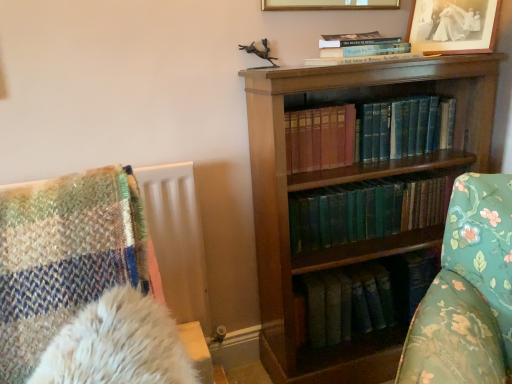
Question: Can you confirm if green leather book at center, the 1th book in the bottom-to-top sequence, is thinner than blue leather book at center, which is the 2th book from top to bottom?

Choices:
 (A) yes
 (B) no

Answer: (B)

Question: From the image's perspective, would you say green leather book at center, positioned as the third book in top-to-bottom order, is shown under blue leather book at center, the 2th book ordered from the bottom?

Choices:
 (A) yes
 (B) no

Answer: (A)

Question: Does green leather book at center, the 1th book in the bottom-to-top sequence, have a greater width compared to blue leather book at center, which is the 2th book from top to bottom?

Choices:
 (A) yes
 (B) no

Answer: (A)

Question: Considering the relative sizes of green leather book at center, positioned as the third book in top-to-bottom order, and blue leather book at center, the 2th book ordered from the bottom, in the image provided, is green leather book at center, positioned as the third book in top-to-bottom order, bigger than blue leather book at center, the 2th book ordered from the bottom,?

Choices:
 (A) yes
 (B) no

Answer: (B)

Question: Does green leather book at center, positioned as the third book in top-to-bottom order, contain blue leather book at center, which is the 2th book from top to bottom?

Choices:
 (A) no
 (B) yes

Answer: (A)

Question: Is green leather book at center, positioned as the third book in top-to-bottom order, facing towards blue leather book at center, which is the 2th book from top to bottom?

Choices:
 (A) no
 (B) yes

Answer: (A)

Question: Considering the relative sizes of black paper picture frame at upper right, which ranks as the first picture frame in right-to-left order, and blue leather book at center, which is the 2th book from top to bottom, in the image provided, is black paper picture frame at upper right, which ranks as the first picture frame in right-to-left order, thinner than blue leather book at center, which is the 2th book from top to bottom,?

Choices:
 (A) yes
 (B) no

Answer: (A)

Question: Is the depth of black paper picture frame at upper right, which ranks as the first picture frame in right-to-left order, less than that of blue leather book at center, the 2th book ordered from the bottom?

Choices:
 (A) no
 (B) yes

Answer: (B)

Question: Is black paper picture frame at upper right, which is the 2th picture frame from left to right, to the left of blue leather book at center, which is the 2th book from top to bottom, from the viewer's perspective?

Choices:
 (A) yes
 (B) no

Answer: (B)

Question: Could you tell me if black paper picture frame at upper right, which ranks as the first picture frame in right-to-left order, is turned towards blue leather book at center, which is the 2th book from top to bottom?

Choices:
 (A) no
 (B) yes

Answer: (A)

Question: Is black paper picture frame at upper right, which ranks as the first picture frame in right-to-left order, positioned beyond the bounds of blue leather book at center, which is the 2th book from top to bottom?

Choices:
 (A) no
 (B) yes

Answer: (B)

Question: Is black paper picture frame at upper right, which ranks as the first picture frame in right-to-left order, positioned behind blue leather book at center, which is the 2th book from top to bottom?

Choices:
 (A) no
 (B) yes

Answer: (A)

Question: From a real-world perspective, is hardcover book at upper center, which is the first book from top to bottom, physically above black paper picture frame at upper right, which ranks as the first picture frame in right-to-left order?

Choices:
 (A) yes
 (B) no

Answer: (B)